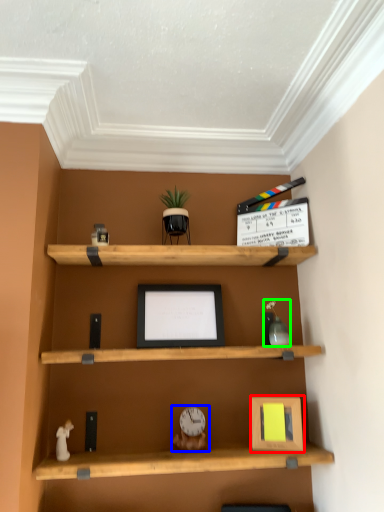
Question: Considering the real-world distances, which object is closest to picture frame (highlighted by a red box)? toy (highlighted by a blue box) or toy (highlighted by a green box).

Choices:
 (A) toy
 (B) toy

Answer: (A)